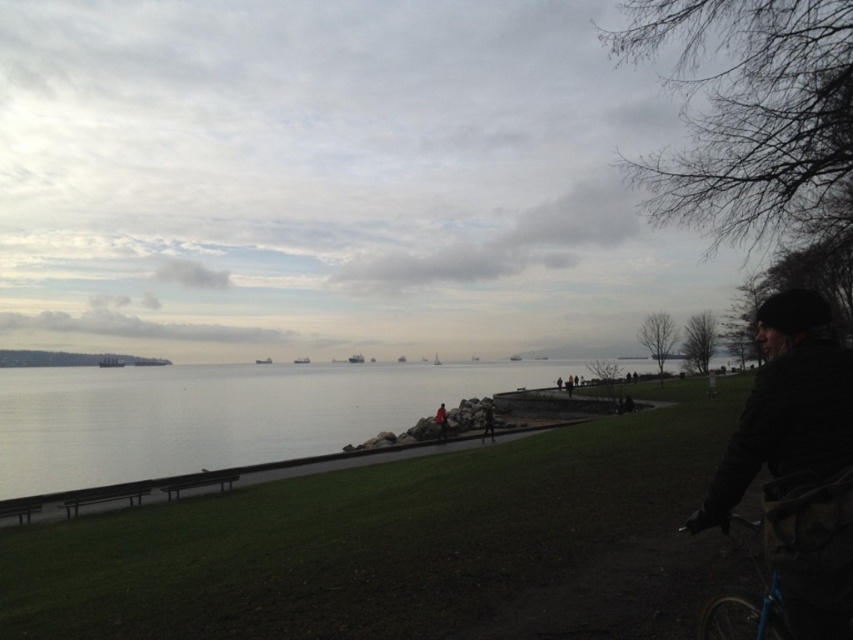
Which is more to the right, dark woolen hat at right or blue metallic bicycle at lower right?

Positioned to the right is dark woolen hat at right.

Does dark woolen hat at right have a greater width compared to blue metallic bicycle at lower right?

Yes.

Who is more forward, (730, 502) or (770, 589)?

Point (730, 502)

Where is `dark woolen hat at right`? The height and width of the screenshot is (640, 853). dark woolen hat at right is located at coordinates (798, 461).